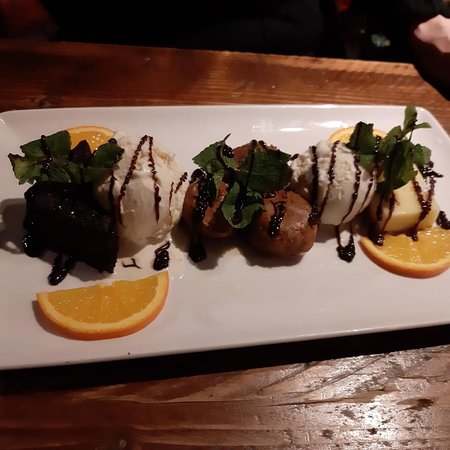
Locate an element on the screen. floor is located at coordinates (41, 24).